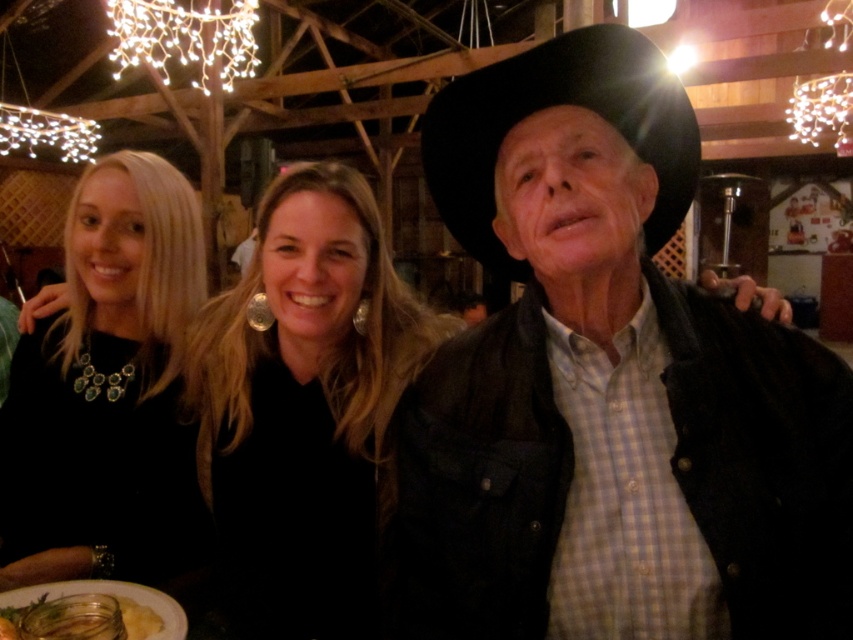
Question: Which point appears closest to the camera in this image?

Choices:
 (A) (589, 157)
 (B) (245, 300)

Answer: (A)

Question: Is black fabric at center further to the viewer compared to black matte necklace at left?

Choices:
 (A) no
 (B) yes

Answer: (A)

Question: Which point is closer to the camera?

Choices:
 (A) (529, 109)
 (B) (123, 602)
 (C) (526, 99)

Answer: (C)

Question: Observing the image, what is the correct spatial positioning of black fabric at center in reference to translucent glass plate at lower left?

Choices:
 (A) left
 (B) right

Answer: (B)

Question: Is black leather cowboy hat at center further to camera compared to black fabric at center?

Choices:
 (A) yes
 (B) no

Answer: (B)

Question: Which point is closer to the camera?

Choices:
 (A) translucent glass plate at lower left
 (B) black matte necklace at left

Answer: (A)